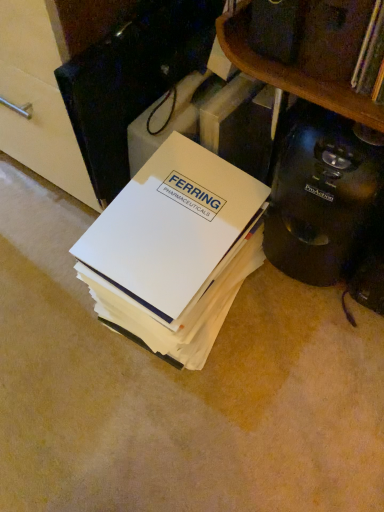
Question: From a real-world perspective, does black plastic coffee maker at lower right sit lower than white paper at center?

Choices:
 (A) no
 (B) yes

Answer: (A)

Question: Is black plastic coffee maker at lower right not close to white paper at center?

Choices:
 (A) no
 (B) yes

Answer: (A)

Question: Is black plastic coffee maker at lower right outside of white paper at center?

Choices:
 (A) no
 (B) yes

Answer: (B)

Question: Is black plastic coffee maker at lower right at the left side of white paper at center?

Choices:
 (A) yes
 (B) no

Answer: (B)

Question: Can you confirm if black plastic coffee maker at lower right is bigger than white paper at center?

Choices:
 (A) no
 (B) yes

Answer: (A)

Question: From a real-world perspective, does black plastic coffee maker at lower right stand above white paper at center?

Choices:
 (A) no
 (B) yes

Answer: (B)

Question: Does white paper at center come in front of black plastic coffee maker at lower right?

Choices:
 (A) no
 (B) yes

Answer: (A)

Question: From a real-world perspective, is white paper at center located beneath black plastic coffee maker at lower right?

Choices:
 (A) yes
 (B) no

Answer: (A)

Question: From the image's perspective, does white paper at center appear higher than black plastic coffee maker at lower right?

Choices:
 (A) no
 (B) yes

Answer: (A)

Question: From a real-world perspective, is white paper at center physically above black plastic coffee maker at lower right?

Choices:
 (A) yes
 (B) no

Answer: (B)

Question: Is white paper at center outside black plastic coffee maker at lower right?

Choices:
 (A) no
 (B) yes

Answer: (B)

Question: Is white paper at center further to the viewer compared to black plastic coffee maker at lower right?

Choices:
 (A) no
 (B) yes

Answer: (B)

Question: Is white paper at center wider or thinner than black plastic coffee maker at lower right?

Choices:
 (A) wide
 (B) thin

Answer: (A)